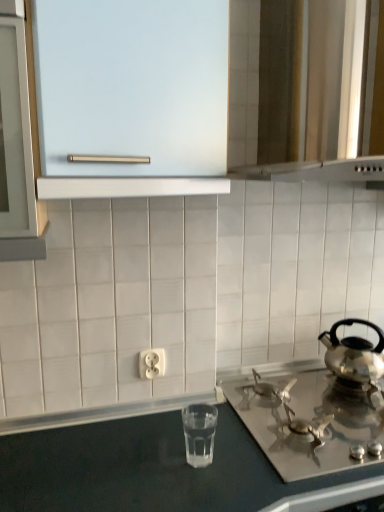
Question: Can you confirm if frosted glass cabinet at upper center is thinner than metallic silver vent at upper right?

Choices:
 (A) yes
 (B) no

Answer: (A)

Question: From a real-world perspective, is frosted glass cabinet at upper center physically below metallic silver vent at upper right?

Choices:
 (A) yes
 (B) no

Answer: (A)

Question: Considering the relative positions of frosted glass cabinet at upper center and metallic silver vent at upper right in the image provided, is frosted glass cabinet at upper center to the left of metallic silver vent at upper right from the viewer's perspective?

Choices:
 (A) yes
 (B) no

Answer: (A)

Question: Is metallic silver vent at upper right surrounded by frosted glass cabinet at upper center?

Choices:
 (A) no
 (B) yes

Answer: (A)

Question: Is frosted glass cabinet at upper center closer to the viewer compared to metallic silver vent at upper right?

Choices:
 (A) no
 (B) yes

Answer: (B)

Question: Do you think clear glass water at lower center is within metallic silver vent at upper right, or outside of it?

Choices:
 (A) inside
 (B) outside

Answer: (B)

Question: In the image, is clear glass water at lower center positioned in front of or behind metallic silver vent at upper right?

Choices:
 (A) behind
 (B) front

Answer: (A)

Question: Considering the positions of point (187, 444) and point (278, 75), is point (187, 444) closer or farther from the camera than point (278, 75)?

Choices:
 (A) closer
 (B) farther

Answer: (A)

Question: From the image's perspective, is clear glass water at lower center located above or below metallic silver vent at upper right?

Choices:
 (A) above
 (B) below

Answer: (B)

Question: Visually, is frosted glass cabinet at upper center positioned to the left or to the right of satin silver gas stove at lower right?

Choices:
 (A) left
 (B) right

Answer: (A)

Question: From the image's perspective, is frosted glass cabinet at upper center located above or below satin silver gas stove at lower right?

Choices:
 (A) below
 (B) above

Answer: (B)

Question: Is frosted glass cabinet at upper center taller or shorter than satin silver gas stove at lower right?

Choices:
 (A) short
 (B) tall

Answer: (B)

Question: Is point (x=66, y=103) closer or farther from the camera than point (x=352, y=400)?

Choices:
 (A) farther
 (B) closer

Answer: (B)

Question: From their relative heights in the image, would you say metallic silver vent at upper right is taller or shorter than white plastic outlet at center?

Choices:
 (A) short
 (B) tall

Answer: (B)

Question: From the image's perspective, is metallic silver vent at upper right positioned above or below white plastic outlet at center?

Choices:
 (A) below
 (B) above

Answer: (B)